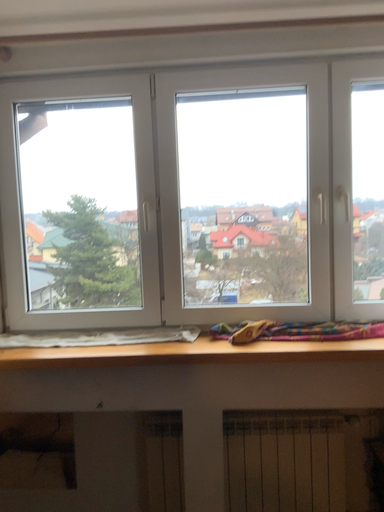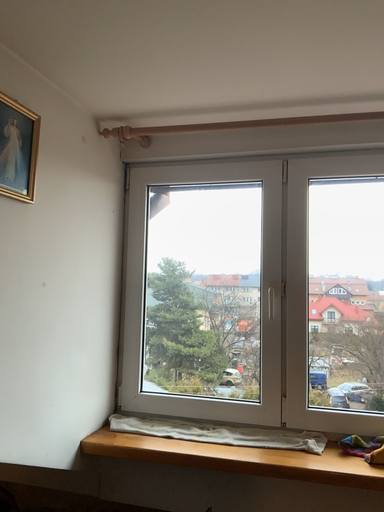
Question: How did the camera likely rotate when shooting the video?

Choices:
 (A) rotated left
 (B) rotated right

Answer: (A)